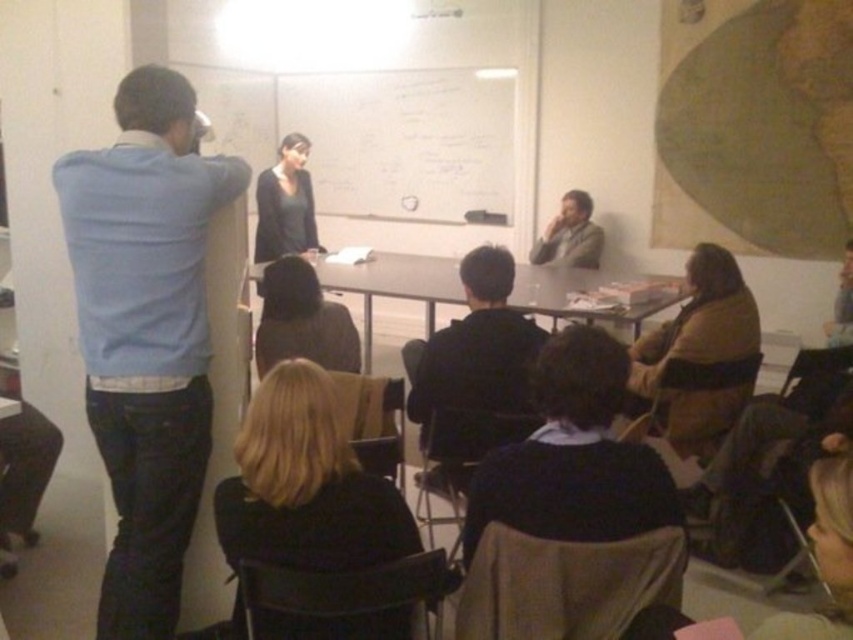
Describe the element at coordinates (473, 369) in the screenshot. I see `black matte jacket at center` at that location.

Can you confirm if black matte jacket at center is positioned below light brown leather jacket at upper right?

Yes, black matte jacket at center is below light brown leather jacket at upper right.

Where is `black matte jacket at center`? This screenshot has height=640, width=853. black matte jacket at center is located at coordinates (473, 369).

The width and height of the screenshot is (853, 640). I want to click on black matte jacket at center, so click(473, 369).

Does blue sweater at left have a greater height compared to light brown leather jacket at upper right?

Yes, blue sweater at left is taller than light brown leather jacket at upper right.

What do you see at coordinates (146, 333) in the screenshot? The height and width of the screenshot is (640, 853). I see `blue sweater at left` at bounding box center [146, 333].

Where is `blue sweater at left`? This screenshot has width=853, height=640. blue sweater at left is located at coordinates (146, 333).

Describe the element at coordinates (146, 333) in the screenshot. The height and width of the screenshot is (640, 853). I see `blue sweater at left` at that location.

Can you confirm if blue sweater at left is shorter than black matte jacket at center?

In fact, blue sweater at left may be taller than black matte jacket at center.

Is point (103, 305) positioned before point (463, 432)?

That is True.

The image size is (853, 640). Find the location of `blue sweater at left`. blue sweater at left is located at coordinates (146, 333).